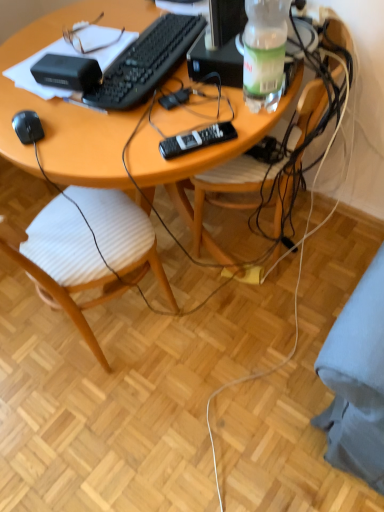
At what (x,y) coordinates should I click in order to perform the action: click on free space to the left of clear plastic bottle at upper right. Please return your answer as a coordinate pair (x, y). Image resolution: width=384 pixels, height=512 pixels. Looking at the image, I should click on (201, 110).